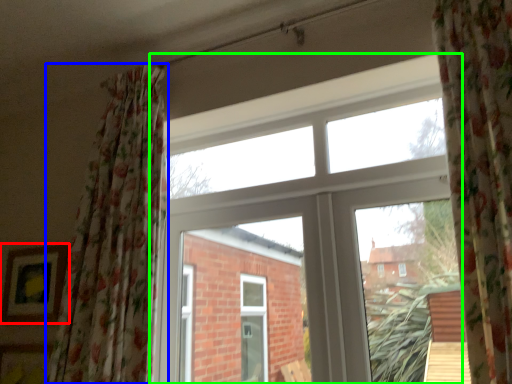
Question: Which object is the closest to the picture frame (highlighted by a red box)? Choose among these: curtain (highlighted by a blue box) or window (highlighted by a green box).

Choices:
 (A) curtain
 (B) window

Answer: (A)